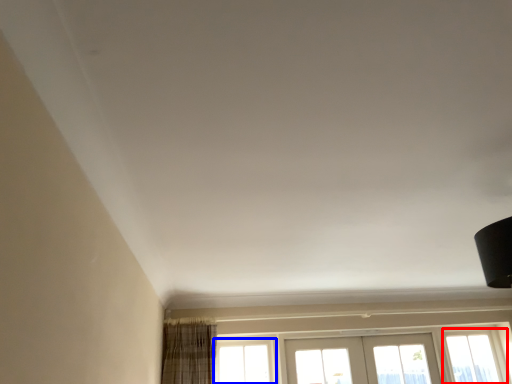
Question: Among these objects, which one is nearest to the camera, window (highlighted by a red box) or window (highlighted by a blue box)?

Choices:
 (A) window
 (B) window

Answer: (B)